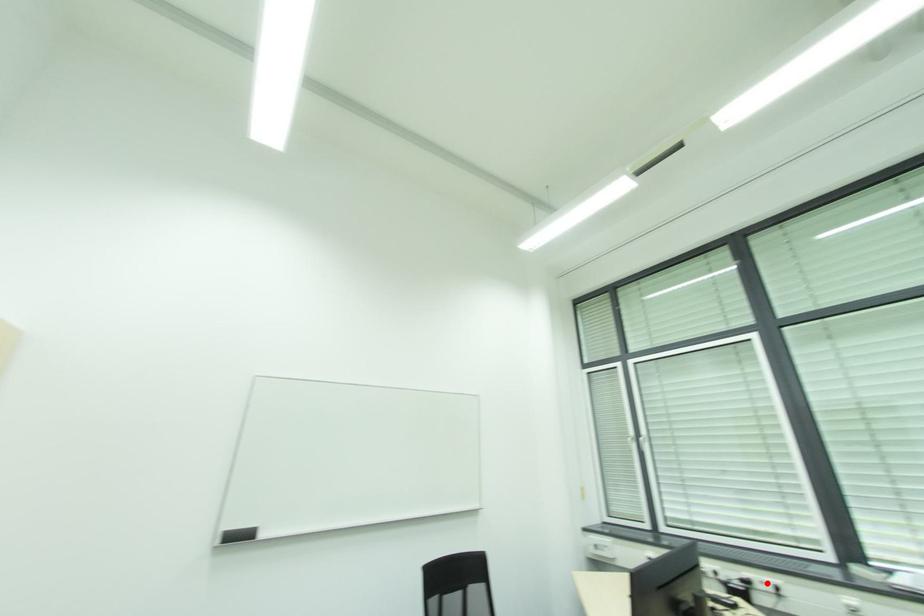
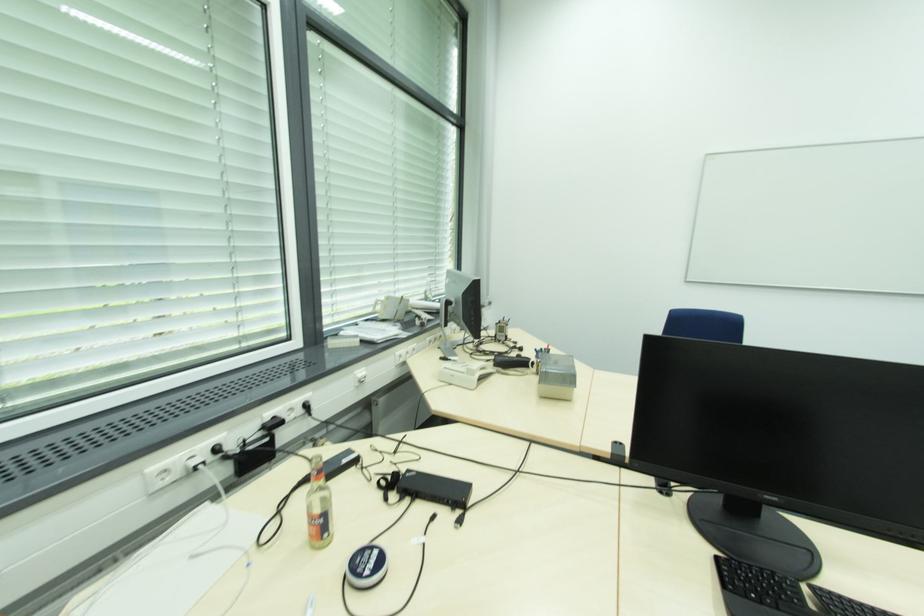
Find the pixel in the second image that matches the highlighted location in the first image.

(294, 410)